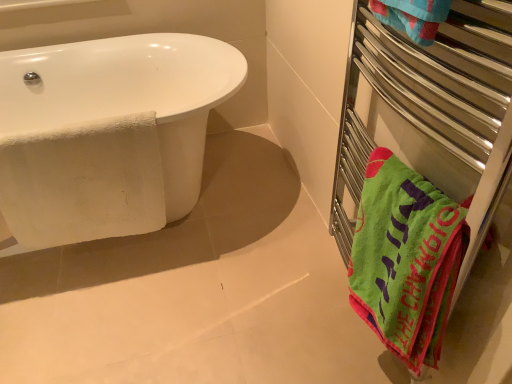
Question: Considering their positions, is white textured towel at left located in front of or behind green soft towel at right?

Choices:
 (A) front
 (B) behind

Answer: (B)

Question: Is white textured towel at left taller or shorter than green soft towel at right?

Choices:
 (A) short
 (B) tall

Answer: (B)

Question: Estimate the real-world distances between objects in this image. Which object is closer to the green fabric towel at right?

Choices:
 (A) white textured towel at left
 (B) white glossy bathtub at left
 (C) green soft towel at right

Answer: (C)

Question: Which of these objects is positioned farthest from the green fabric towel at right?

Choices:
 (A) white glossy bathtub at left
 (B) green soft towel at right
 (C) white textured towel at left

Answer: (A)